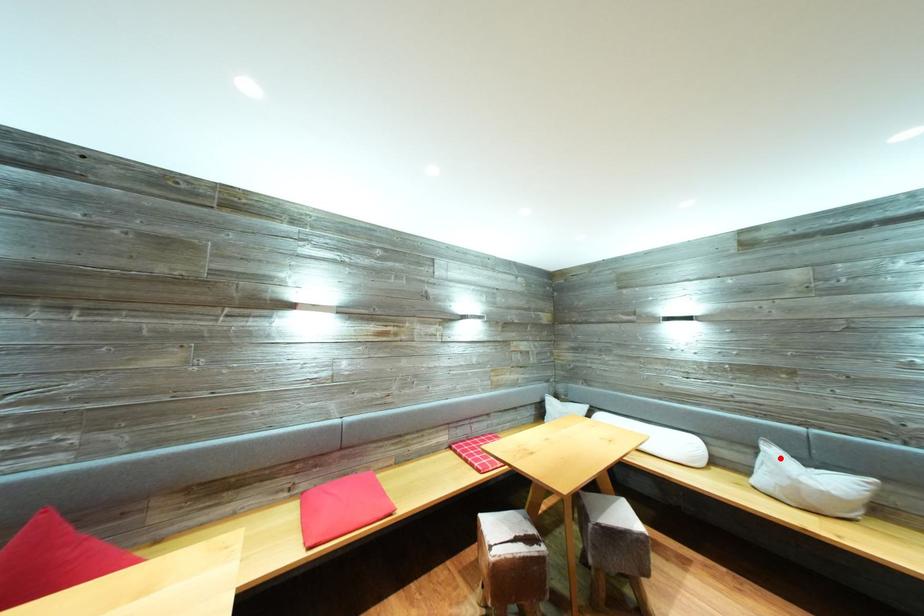
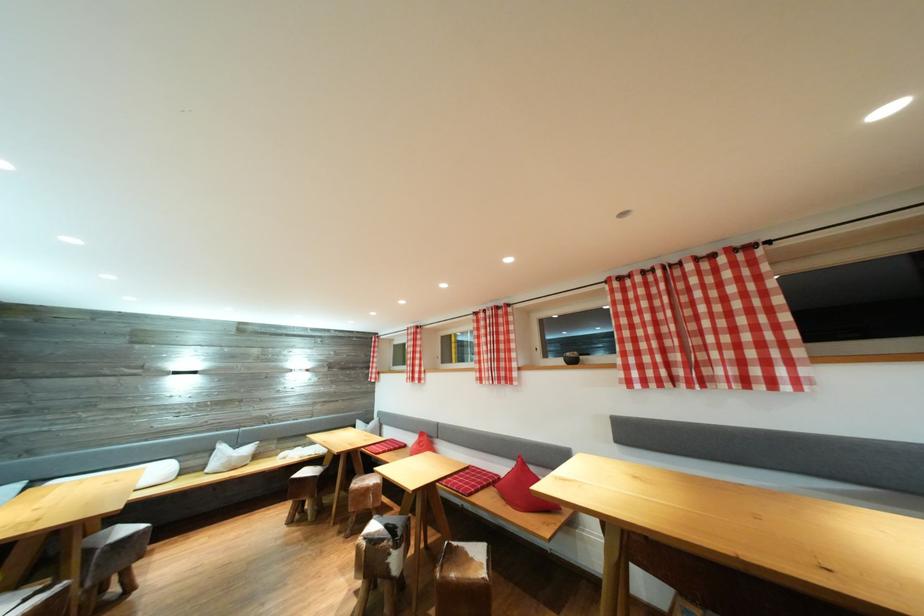
Locate, in the second image, the point that corresponds to the highlighted location in the first image.

(228, 453)